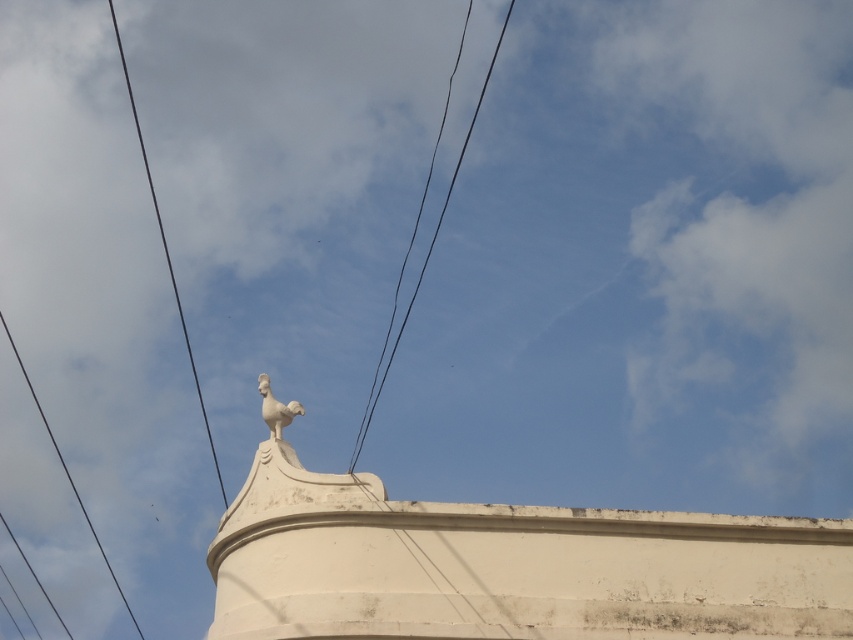
Question: Where is black wire at center located in relation to white stone rooster at upper center in the image?

Choices:
 (A) right
 (B) left

Answer: (A)

Question: Among these points, which one is farthest from the camera?

Choices:
 (A) (107, 563)
 (B) (117, 29)
 (C) (502, 36)

Answer: (B)

Question: Is black wire at upper left positioned in front of white stone rooster at upper center?

Choices:
 (A) no
 (B) yes

Answer: (A)

Question: Among these points, which one is nearest to the camera?

Choices:
 (A) (33, 396)
 (B) (460, 150)

Answer: (B)

Question: Is black wire at center positioned in front of black wire at upper left?

Choices:
 (A) no
 (B) yes

Answer: (B)

Question: Which object is closer to the camera taking this photo?

Choices:
 (A) black wire at left
 (B) black wire at upper left

Answer: (A)